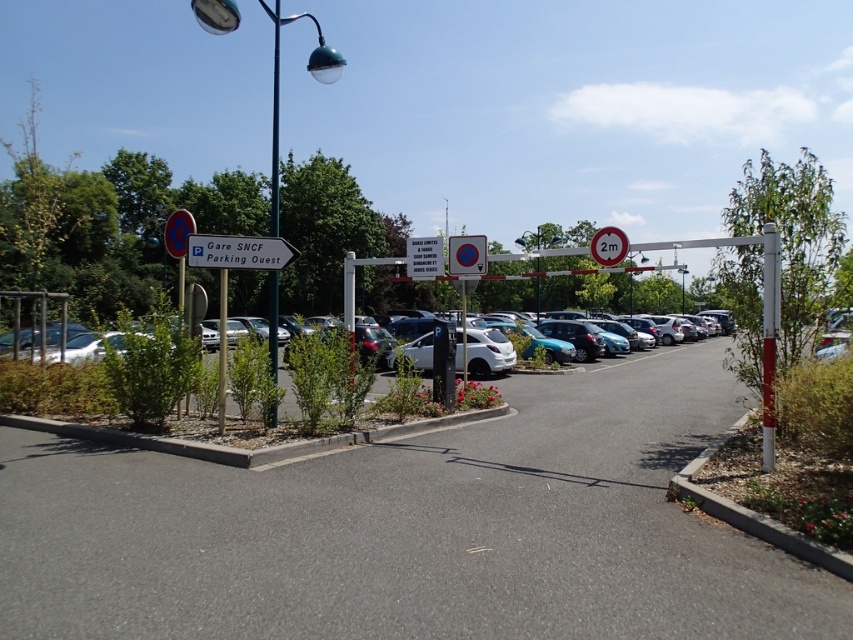
Does white matte car at center appear on the left side of metallic pole at center?

Indeed, white matte car at center is positioned on the left side of metallic pole at center.

Can you confirm if white matte car at center is bigger than metallic pole at center?

Actually, white matte car at center might be smaller than metallic pole at center.

What do you see at coordinates (643, 356) in the screenshot? The image size is (853, 640). I see `white matte car at center` at bounding box center [643, 356].

Image resolution: width=853 pixels, height=640 pixels. Identify the location of white matte car at center. (643, 356).

Does white plastic sign at left appear over white matte car at center?

Yes, white plastic sign at left is above white matte car at center.

Measure the distance between white plastic sign at left and camera.

A distance of 29.27 feet exists between white plastic sign at left and camera.

Find the location of a particular element. Image resolution: width=853 pixels, height=640 pixels. white plastic sign at left is located at coordinates (238, 252).

Which is more to the right, metallic pole at right or white matte car at center?

Positioned to the right is white matte car at center.

Which is behind, point (769, 296) or point (596, 369)?

The point (596, 369) is behind.

The width and height of the screenshot is (853, 640). In order to click on metallic pole at right in this screenshot , I will do `click(769, 339)`.